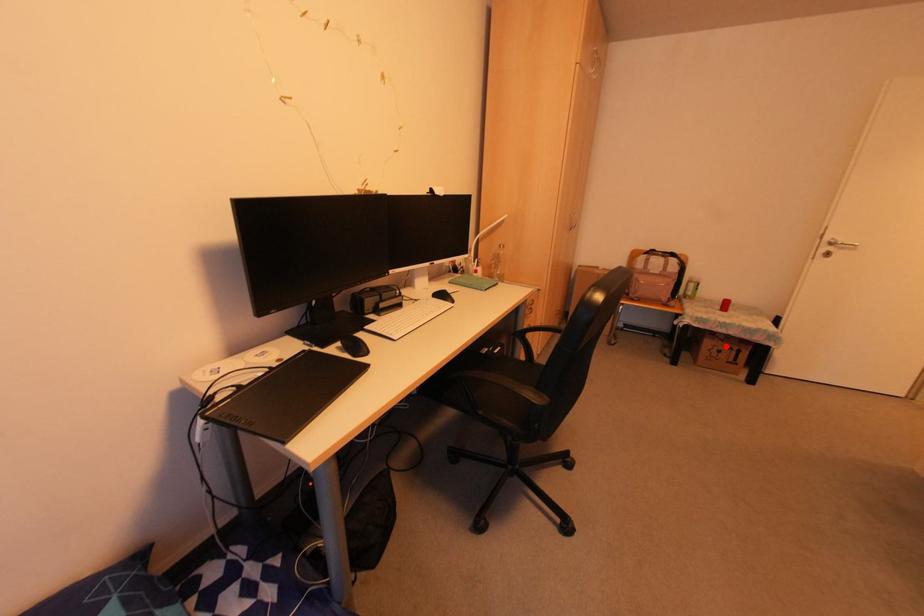
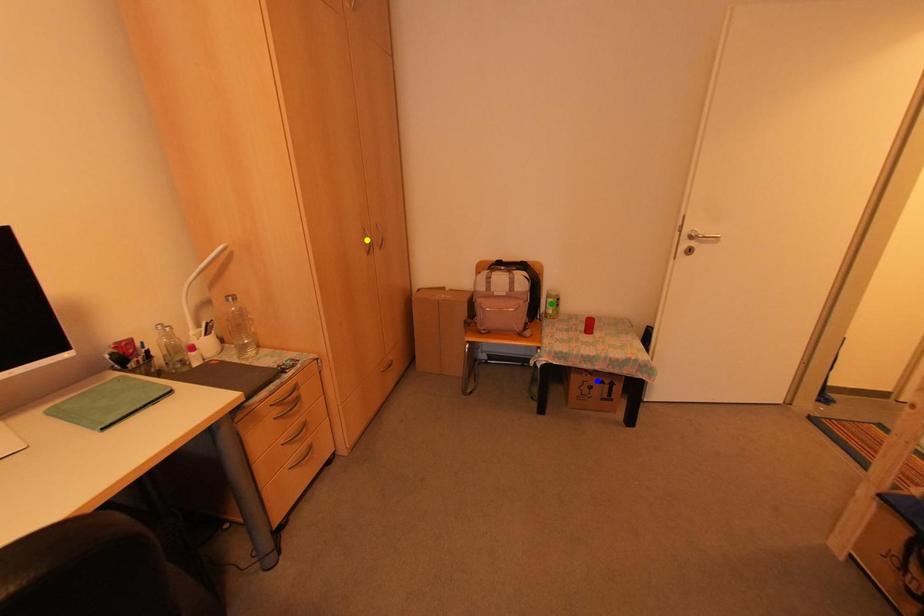
Question: I am providing you with two images of the same scene from different viewpoints. A red point is marked on the first image. You are given multiple points on the second image. In image 2, which mark is for the same physical point as the one in image 1?

Choices:
 (A) blue point
 (B) yellow point
 (C) green point

Answer: (A)